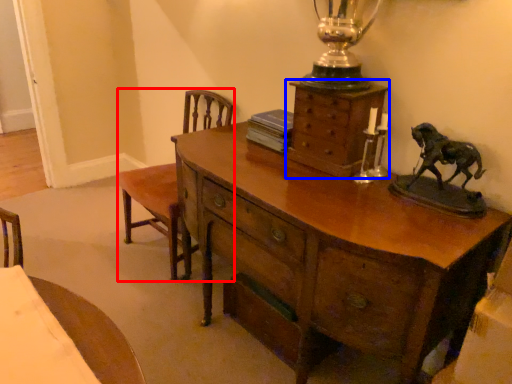
Question: Which of the following is the farthest to the observer, armchair (highlighted by a red box) or chest of drawers (highlighted by a blue box)?

Choices:
 (A) armchair
 (B) chest of drawers

Answer: (A)